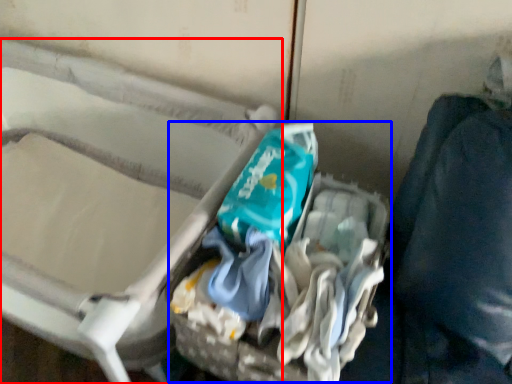
Question: Which of the following is the farthest to the observer, furniture (highlighted by a red box) or garbage (highlighted by a blue box)?

Choices:
 (A) furniture
 (B) garbage

Answer: (B)